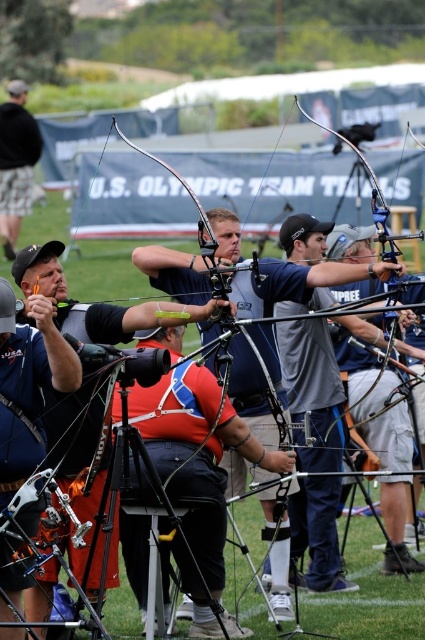
Question: Is matte black camera at left positioned before black fabric jacket at upper left?

Choices:
 (A) no
 (B) yes

Answer: (B)

Question: Is matte black camera at left above black fabric jacket at upper left?

Choices:
 (A) no
 (B) yes

Answer: (A)

Question: Which object appears farthest from the camera in this image?

Choices:
 (A) black fabric jacket at upper left
 (B) matte black camera at left

Answer: (A)

Question: Is matte black camera at left to the left of black fabric jacket at upper left from the viewer's perspective?

Choices:
 (A) yes
 (B) no

Answer: (B)